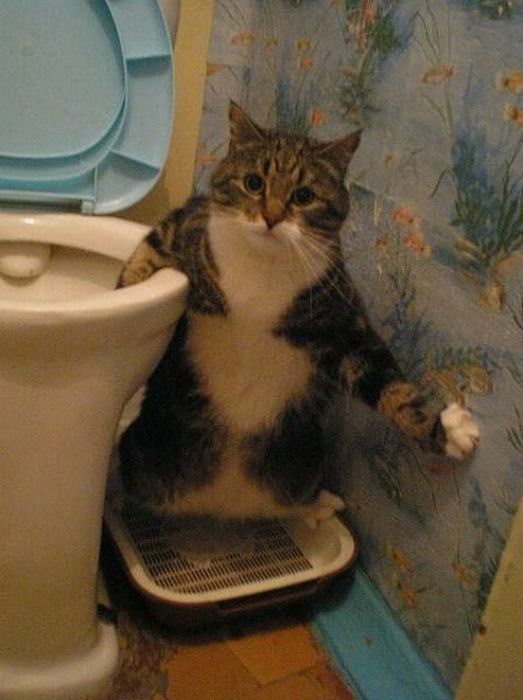
The width and height of the screenshot is (523, 700). Find the location of `inside toilet`. inside toilet is located at coordinates (56, 286).